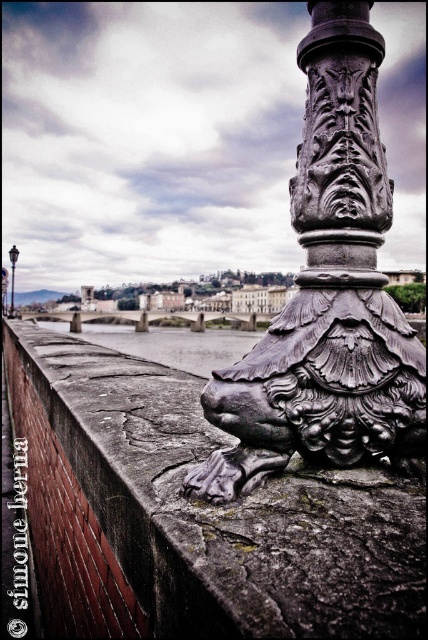
Does rusty stone ledge at center have a smaller size compared to polished metal column at center?

No.

Between point (51, 529) and point (368, 179), which one is positioned in front?

Positioned in front is point (368, 179).

Is point (413, 493) closer to viewer compared to point (377, 177)?

Yes, it is in front of point (377, 177).

Find the location of a particular element. The image size is (428, 640). rusty stone ledge at center is located at coordinates (195, 515).

Which of these two, polished metal column at center or polished metal lamp post at upper center, stands taller?

polished metal lamp post at upper center is taller.

Based on the photo, can you confirm if polished metal column at center is bigger than polished metal lamp post at upper center?

Actually, polished metal column at center might be smaller than polished metal lamp post at upper center.

The image size is (428, 640). What are the coordinates of `polished metal column at center` in the screenshot? It's located at (341, 128).

At what (x,y) coordinates should I click in order to perform the action: click on polished metal column at center. Please return your answer as a coordinate pair (x, y). Image resolution: width=428 pixels, height=640 pixels. Looking at the image, I should click on (341, 128).

Where is `polished metal lion at center`? Image resolution: width=428 pixels, height=640 pixels. polished metal lion at center is located at coordinates (326, 294).

Does polished metal lion at center have a lesser height compared to polished metal lamp post at upper center?

Yes.

Who is more forward, (350, 300) or (17, 250)?

Point (350, 300) is in front.

The image size is (428, 640). In order to click on polished metal lion at center in this screenshot , I will do `click(326, 294)`.